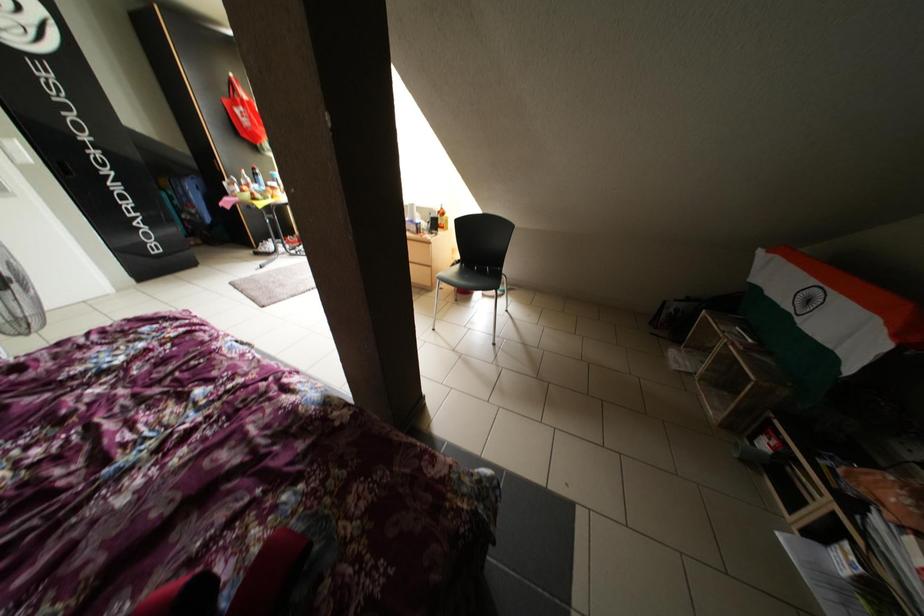
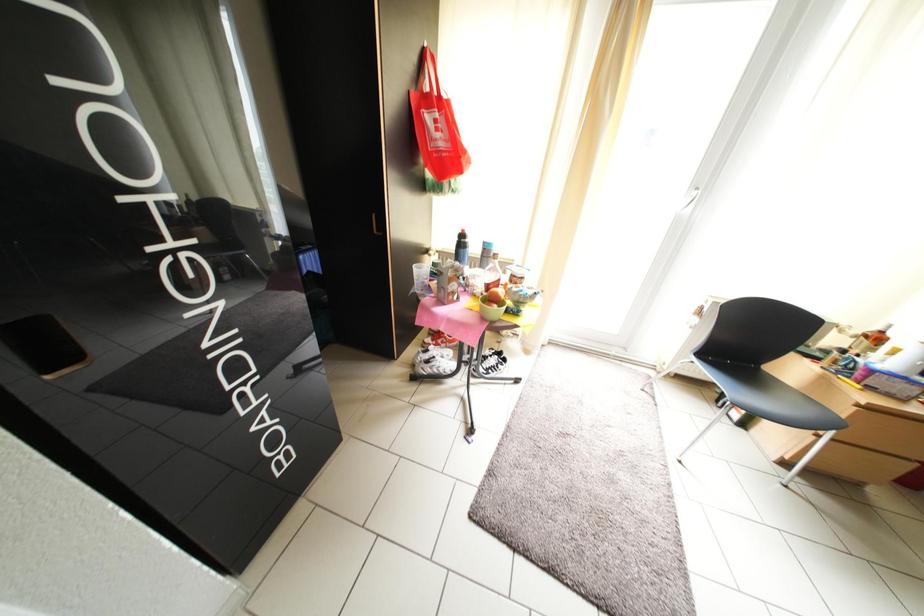
What movement of the cameraman would produce the second image?

The cameraman walked toward left, forward.